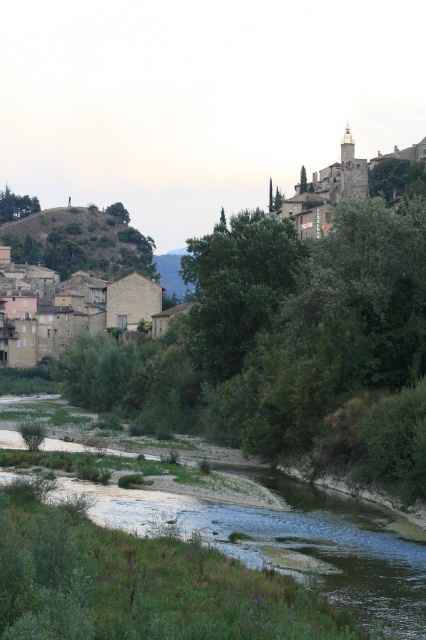
From the picture: Does green leafy tree at center have a greater height compared to green leafy tree at upper left?

No.

Can you confirm if green leafy tree at center is smaller than green leafy tree at upper left?

Indeed, green leafy tree at center has a smaller size compared to green leafy tree at upper left.

Is point (267, 308) farther from viewer compared to point (31, 205)?

That is False.

Locate an element on the screen. This screenshot has width=426, height=640. green leafy tree at center is located at coordinates (238, 285).

Is stone tower at upper right closer to camera compared to green leafy tree at upper center?

Yes, stone tower at upper right is in front of green leafy tree at upper center.

Can you confirm if stone tower at upper right is bigger than green leafy tree at upper center?

Correct, stone tower at upper right is larger in size than green leafy tree at upper center.

The height and width of the screenshot is (640, 426). In order to click on stone tower at upper right in this screenshot , I will do `click(328, 189)`.

This screenshot has height=640, width=426. Identify the location of stone tower at upper right. (328, 189).

Does point (89, 209) come farther from viewer compared to point (118, 202)?

No, it is in front of (118, 202).

Which of these two, green grassy hillside at upper left or green leafy tree at upper center, stands taller?

green grassy hillside at upper left

Who is more distant from viewer, (28, 256) or (126, 214)?

Positioned behind is point (126, 214).

Locate an element on the screen. Image resolution: width=426 pixels, height=640 pixels. green grassy hillside at upper left is located at coordinates (80, 243).